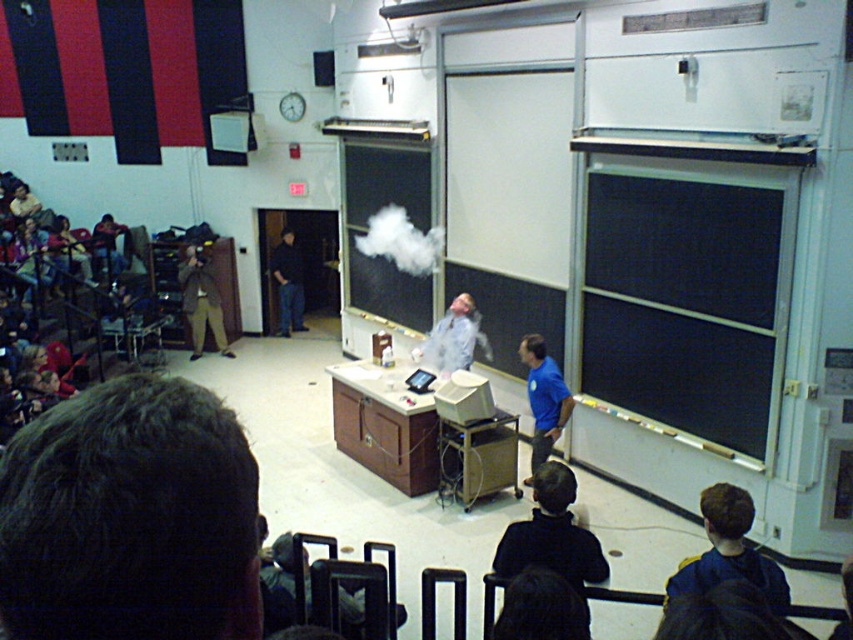
You are a student standing in the classroom. You want to safely observe the science experiment without moving closer than 6 feet from the white smoke at center. Can you stay at your current position, which is the same as where the dark blue jeans at center are located?

The distance between white smoke at center and dark blue jeans at center is 8.05 feet, which is more than 6 feet. Therefore, you can safely observe the experiment from your current position without moving closer.

You are a student in the classroom and you see the white smoke at center and the dark blue jeans at center. Which object is higher in the image?

The white smoke at center is higher than the dark blue jeans at center because it is positioned above it.